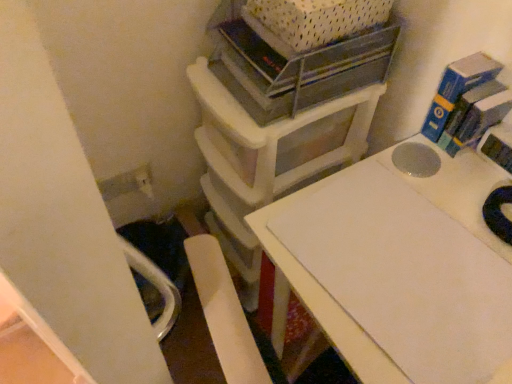
Question: Is metallic gray shelf at upper center aimed at white plastic crate at upper center?

Choices:
 (A) no
 (B) yes

Answer: (A)

Question: Considering the relative sizes of metallic gray shelf at upper center and white plastic crate at upper center in the image provided, is metallic gray shelf at upper center thinner than white plastic crate at upper center?

Choices:
 (A) yes
 (B) no

Answer: (B)

Question: Is the surface of metallic gray shelf at upper center in direct contact with white plastic crate at upper center?

Choices:
 (A) no
 (B) yes

Answer: (B)

Question: Is metallic gray shelf at upper center to the left of white plastic crate at upper center from the viewer's perspective?

Choices:
 (A) yes
 (B) no

Answer: (A)

Question: Is white plastic crate at upper center at the back of metallic gray shelf at upper center?

Choices:
 (A) yes
 (B) no

Answer: (B)

Question: Would you say metallic gray shelf at upper center is a long distance from white plastic crate at upper center?

Choices:
 (A) yes
 (B) no

Answer: (B)

Question: Is metallic gray shelf at upper center not within white plastic storage unit at upper center?

Choices:
 (A) yes
 (B) no

Answer: (A)

Question: Does metallic gray shelf at upper center have a lesser height compared to white plastic storage unit at upper center?

Choices:
 (A) yes
 (B) no

Answer: (A)

Question: Would you consider metallic gray shelf at upper center to be distant from white plastic storage unit at upper center?

Choices:
 (A) no
 (B) yes

Answer: (A)

Question: Does metallic gray shelf at upper center lie in front of white plastic storage unit at upper center?

Choices:
 (A) yes
 (B) no

Answer: (A)

Question: Is metallic gray shelf at upper center taller than white plastic storage unit at upper center?

Choices:
 (A) yes
 (B) no

Answer: (B)

Question: Is white plastic storage unit at upper center surrounded by metallic gray shelf at upper center?

Choices:
 (A) yes
 (B) no

Answer: (B)

Question: Is white plastic storage unit at upper center next to white matte table at center and touching it?

Choices:
 (A) no
 (B) yes

Answer: (A)